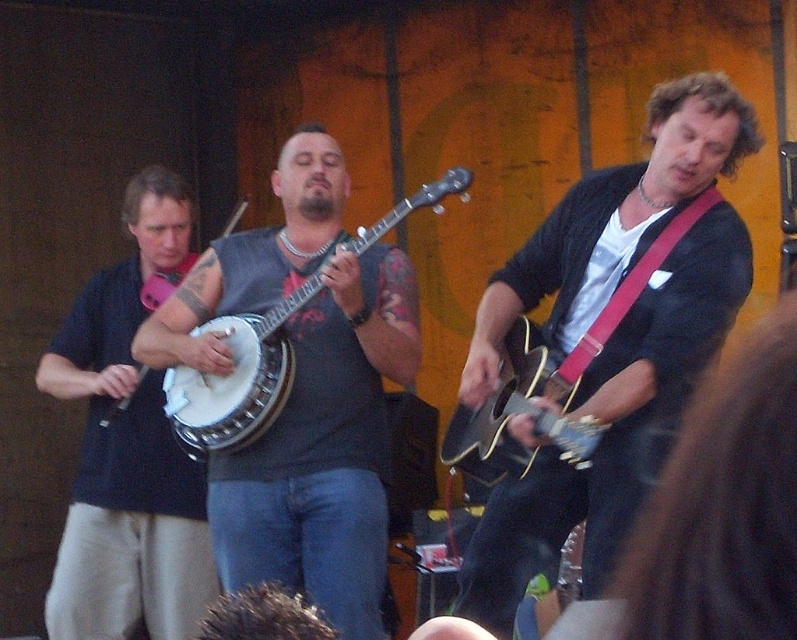
Question: Can you confirm if matte black banjo at left is positioned to the left of matte wood banjo at center?

Choices:
 (A) yes
 (B) no

Answer: (A)

Question: Which point is farther to the camera?

Choices:
 (A) (364, 228)
 (B) (96, 342)
 (C) (165, 307)

Answer: (A)

Question: Estimate the real-world distances between objects in this image. Which object is closer to the matte black guitar at center?

Choices:
 (A) matte black banjo at left
 (B) matte black banjo at center
 (C) white wood banjo at center
 (D) matte wood banjo at center

Answer: (D)

Question: Based on their relative distances, which object is nearer to the matte black banjo at center?

Choices:
 (A) white wood banjo at center
 (B) matte black banjo at left

Answer: (A)

Question: Can you confirm if matte black guitar at center is positioned to the left of white wood banjo at center?

Choices:
 (A) no
 (B) yes

Answer: (A)

Question: Can you confirm if matte black banjo at left is bigger than matte wood banjo at center?

Choices:
 (A) no
 (B) yes

Answer: (B)